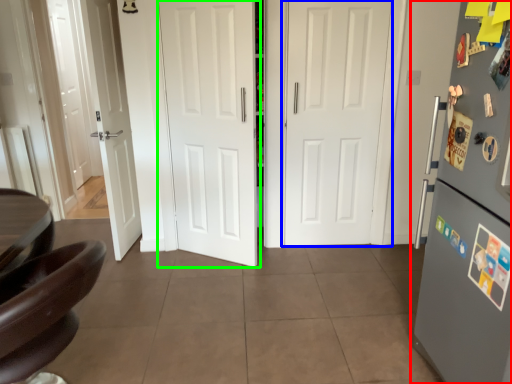
Question: Estimate the real-world distances between objects in this image. Which object is closer to refrigerator (highlighted by a red box), door (highlighted by a blue box) or door (highlighted by a green box)?

Choices:
 (A) door
 (B) door

Answer: (A)